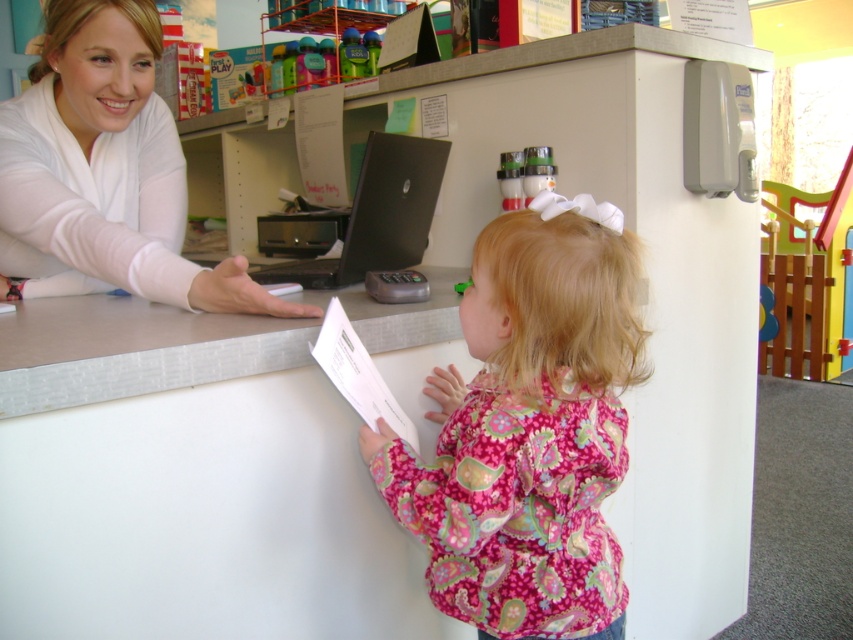
Question: Among these objects, which one is farthest from the camera?

Choices:
 (A) matte white shirt at upper left
 (B) black matte laptop at center

Answer: (B)

Question: Is white smooth desk at center in front of matte white shirt at upper left?

Choices:
 (A) no
 (B) yes

Answer: (B)

Question: Which point is farther to the camera?

Choices:
 (A) matte white shirt at upper left
 (B) pink floral shirt at center
 (C) black matte laptop at center
 (D) white smooth desk at center

Answer: (C)

Question: Can you confirm if pink floral shirt at center is smaller than matte white shirt at upper left?

Choices:
 (A) no
 (B) yes

Answer: (B)

Question: Is white smooth desk at center positioned before matte white shirt at upper left?

Choices:
 (A) yes
 (B) no

Answer: (A)

Question: Which object appears closest to the camera in this image?

Choices:
 (A) pink floral shirt at center
 (B) matte white shirt at upper left
 (C) white smooth desk at center
 (D) black matte laptop at center

Answer: (C)